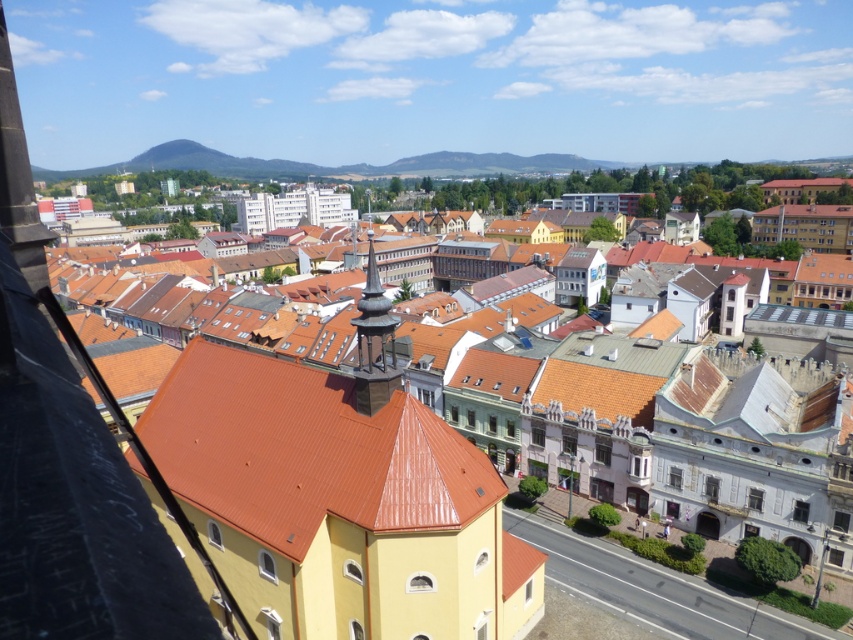
Consider the image. You are a tourist standing in the city square and want to take a photo of the brown tile roof at center without the yellow matte church at center blocking the view. Is there a way to do this?

The brown tile roof at center is behind the yellow matte church at center, so you can move to a position where the yellow matte church at center is not between you and the brown tile roof at center to capture the view.

You are standing at the point with coordinates point [366,305] and want to walk to the point with coordinates point [541,461]. Based on the cityscape described, will the yellow building with the red tiled roof block your path?

Point [541,461] is behind point [366,305], so the yellow building with the red tiled roof will block your path.